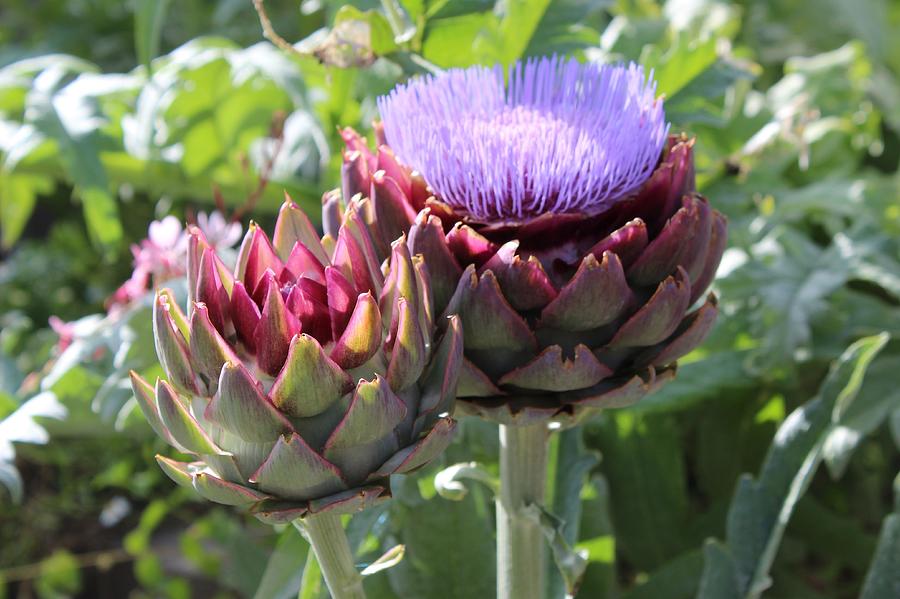
At what (x,y) coordinates should I click in order to perform the action: click on white light. Please return your answer as a coordinate pair (x, y). The image size is (900, 599). Looking at the image, I should click on (686, 15).